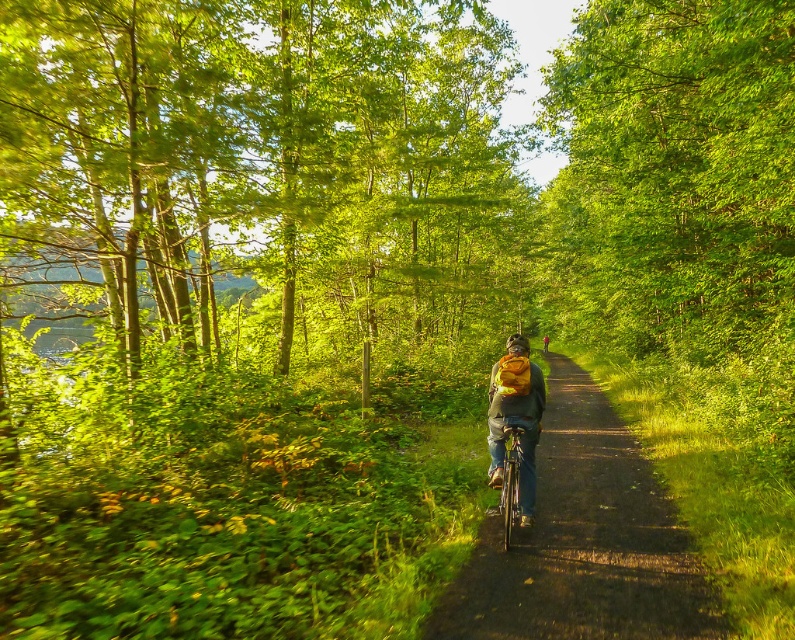
Question: Does smooth asphalt path at center have a greater width compared to shiny metallic bicycle at center?

Choices:
 (A) yes
 (B) no

Answer: (A)

Question: Is green leafy tree at center thinner than smooth asphalt path at center?

Choices:
 (A) no
 (B) yes

Answer: (A)

Question: Does smooth asphalt path at center appear on the left side of shiny metallic bicycle at center?

Choices:
 (A) no
 (B) yes

Answer: (A)

Question: Which object is positioned closest to the smooth asphalt path at center?

Choices:
 (A) green leafy tree at center
 (B) shiny metallic bicycle at center

Answer: (B)

Question: Which point is closer to the camera taking this photo?

Choices:
 (A) (433, 636)
 (B) (460, 115)
 (C) (514, 436)

Answer: (A)

Question: Which of the following is the closest to the observer?

Choices:
 (A) (305, 134)
 (B) (534, 616)

Answer: (B)